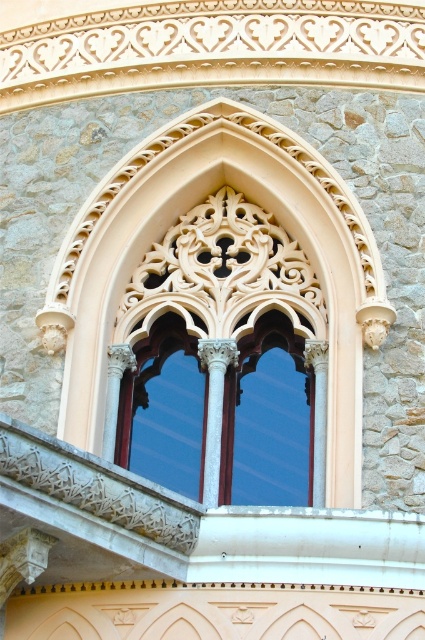
Question: Can you confirm if white stone window at center is positioned above matte glass window at center?

Choices:
 (A) yes
 (B) no

Answer: (A)

Question: Among these points, which one is nearest to the camera?

Choices:
 (A) (209, 392)
 (B) (127, 403)

Answer: (A)

Question: Can you confirm if white stone window at center is positioned to the right of matte glass window at center?

Choices:
 (A) yes
 (B) no

Answer: (A)

Question: Among these points, which one is farthest from the camera?

Choices:
 (A) (198, 499)
 (B) (187, 248)

Answer: (B)

Question: Does white stone window at center have a lesser width compared to matte glass window at center?

Choices:
 (A) no
 (B) yes

Answer: (A)

Question: Which point is farther to the camera?

Choices:
 (A) (238, 256)
 (B) (136, 394)

Answer: (A)